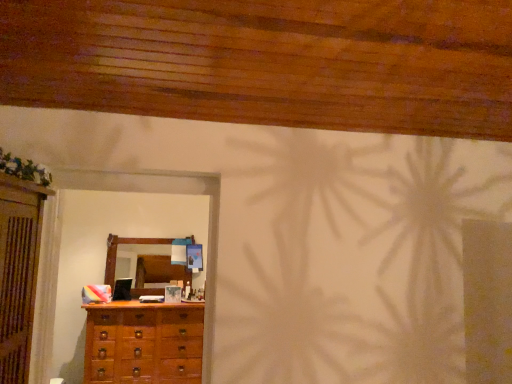
Question: From a real-world perspective, is wooden chest of drawers at lower left positioned above or below wooden mirror at center?

Choices:
 (A) above
 (B) below

Answer: (B)

Question: Considering the positions of wooden chest of drawers at lower left and wooden mirror at center in the image, is wooden chest of drawers at lower left taller or shorter than wooden mirror at center?

Choices:
 (A) short
 (B) tall

Answer: (B)

Question: From the image's perspective, is wooden chest of drawers at lower left located above or below wooden mirror at center?

Choices:
 (A) above
 (B) below

Answer: (B)

Question: Considering their positions, is wooden mirror at center located in front of or behind wooden chest of drawers at lower left?

Choices:
 (A) front
 (B) behind

Answer: (B)

Question: From their relative heights in the image, would you say wooden mirror at center is taller or shorter than wooden chest of drawers at lower left?

Choices:
 (A) tall
 (B) short

Answer: (B)

Question: From the image's perspective, is wooden mirror at center located above or below wooden chest of drawers at lower left?

Choices:
 (A) above
 (B) below

Answer: (A)

Question: Does point (139, 238) appear closer or farther from the camera than point (155, 345)?

Choices:
 (A) farther
 (B) closer

Answer: (A)